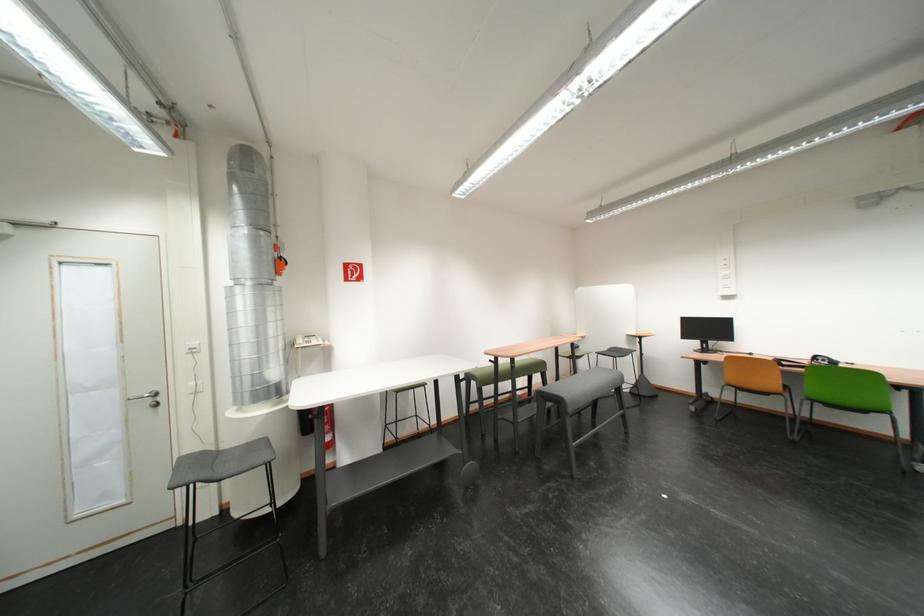
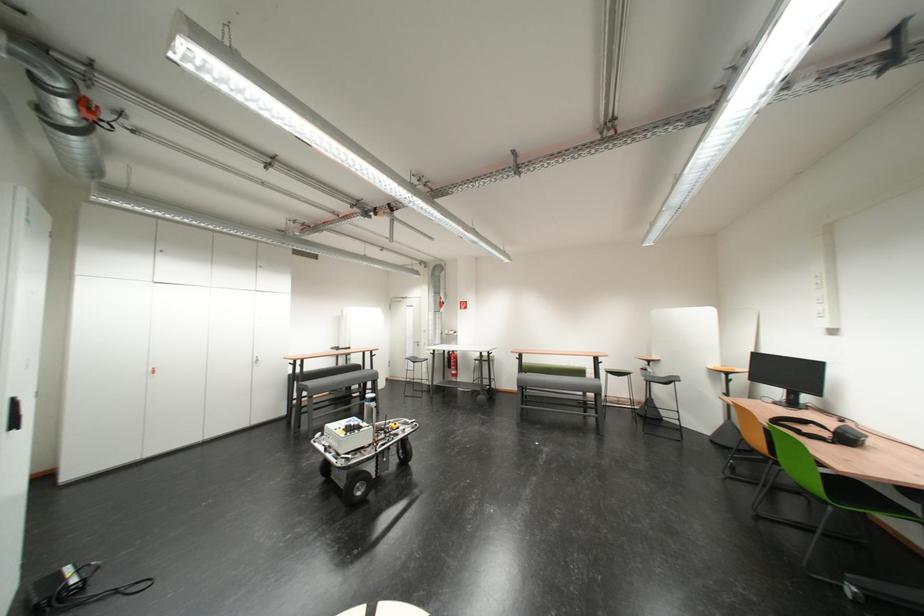
Locate, in the second image, the point that corresponds to point 89,438 in the first image.

(419, 351)